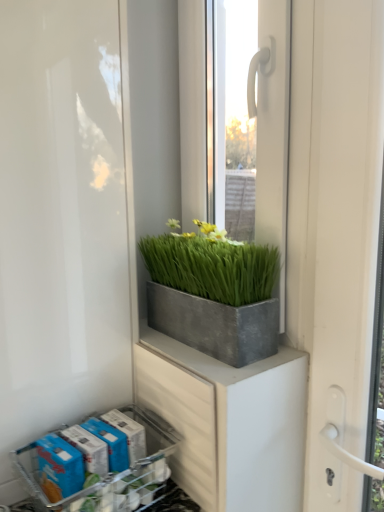
Question: From the image's perspective, is metallic gray flower box at lower left over white matte screen door at left?

Choices:
 (A) no
 (B) yes

Answer: (A)

Question: From a real-world perspective, is metallic gray flower box at lower left under white matte screen door at left?

Choices:
 (A) yes
 (B) no

Answer: (A)

Question: Does metallic gray flower box at lower left appear on the left side of white matte screen door at left?

Choices:
 (A) no
 (B) yes

Answer: (A)

Question: Is metallic gray flower box at lower left to the right of white matte screen door at left from the viewer's perspective?

Choices:
 (A) yes
 (B) no

Answer: (A)

Question: Does metallic gray flower box at lower left have a larger size compared to white matte screen door at left?

Choices:
 (A) yes
 (B) no

Answer: (B)

Question: Considering the relative sizes of metallic gray flower box at lower left and white matte screen door at left in the image provided, is metallic gray flower box at lower left smaller than white matte screen door at left?

Choices:
 (A) yes
 (B) no

Answer: (A)

Question: Does white matte screen door at left have a smaller size compared to metallic gray flower box at lower left?

Choices:
 (A) no
 (B) yes

Answer: (A)

Question: From a real-world perspective, is white matte screen door at left on top of metallic gray flower box at lower left?

Choices:
 (A) yes
 (B) no

Answer: (A)

Question: Is white matte screen door at left far away from metallic gray flower box at lower left?

Choices:
 (A) no
 (B) yes

Answer: (A)

Question: Considering the relative sizes of white matte screen door at left and metallic gray flower box at lower left in the image provided, is white matte screen door at left thinner than metallic gray flower box at lower left?

Choices:
 (A) yes
 (B) no

Answer: (B)

Question: Can you confirm if white matte screen door at left is positioned to the left of metallic gray flower box at lower left?

Choices:
 (A) no
 (B) yes

Answer: (B)

Question: From the image's perspective, is white matte screen door at left on top of metallic gray flower box at lower left?

Choices:
 (A) yes
 (B) no

Answer: (A)

Question: Is metallic gray flower box at lower left outside clear glass window at center?

Choices:
 (A) yes
 (B) no

Answer: (A)